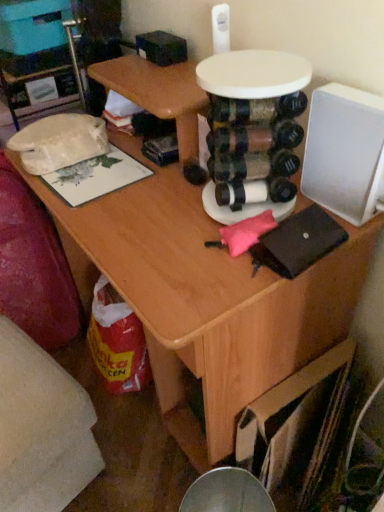
This screenshot has width=384, height=512. What do you see at coordinates (34, 267) in the screenshot?
I see `white fabric swivel chair at lower left` at bounding box center [34, 267].

Measure the distance between white fabric swivel chair at lower left and camera.

white fabric swivel chair at lower left is 1.22 meters away from camera.

At what (x,y) coordinates should I click in order to perform the action: click on white fabric swivel chair at lower left. Please return your answer as a coordinate pair (x, y). This screenshot has width=384, height=512. Looking at the image, I should click on (34, 267).

Measure the distance between point (50, 323) and camera.

Point (50, 323) is 4.84 feet away from camera.

Describe the element at coordinates (253, 131) in the screenshot. I see `white plastic round table at center` at that location.

Locate an element on the screen. This screenshot has height=512, width=384. white plastic round table at center is located at coordinates (253, 131).

This screenshot has height=512, width=384. I want to click on white fabric swivel chair at lower left, so click(x=34, y=267).

Based on the photo, in the image, is white fabric swivel chair at lower left on the left side or the right side of white plastic round table at center?

Based on their positions, white fabric swivel chair at lower left is located to the left of white plastic round table at center.

Which object is further away from the camera, white fabric swivel chair at lower left or white plastic round table at center?

white fabric swivel chair at lower left is behind.

Is point (16, 217) more distant than point (261, 109)?

Yes, it is behind point (261, 109).

Based on the photo, from the image's perspective, which is below, white fabric swivel chair at lower left or white plastic round table at center?

white fabric swivel chair at lower left appears lower in the image.

From a real-world perspective, is white fabric swivel chair at lower left physically below white plastic round table at center?

Yes, from a real-world perspective, white fabric swivel chair at lower left is beneath white plastic round table at center.

Which of these two, white fabric swivel chair at lower left or white plastic round table at center, is wider?

white fabric swivel chair at lower left is wider.

Between white fabric swivel chair at lower left and white plastic round table at center, which one has more height?

white fabric swivel chair at lower left is taller.

Considering the relative sizes of white fabric swivel chair at lower left and white plastic round table at center in the image provided, is white fabric swivel chair at lower left smaller than white plastic round table at center?

No, white fabric swivel chair at lower left is not smaller than white plastic round table at center.

Is white fabric swivel chair at lower left not inside white plastic round table at center?

Yes, white fabric swivel chair at lower left is outside of white plastic round table at center.

Is white fabric swivel chair at lower left positioned far away from white plastic round table at center?

That's not correct — white fabric swivel chair at lower left is a little close to white plastic round table at center.

Is white fabric swivel chair at lower left oriented towards white plastic round table at center?

No, white fabric swivel chair at lower left is not facing towards white plastic round table at center.

What's the angular difference between white fabric swivel chair at lower left and white plastic round table at center's facing directions?

There is a 83.6-degree angle between the facing directions of white fabric swivel chair at lower left and white plastic round table at center.

The height and width of the screenshot is (512, 384). I want to click on round table above the white fabric swivel chair at lower left (from the image's perspective), so click(x=253, y=131).

Visually, is white plastic round table at center positioned to the left or to the right of white fabric swivel chair at lower left?

Clearly, white plastic round table at center is on the right of white fabric swivel chair at lower left in the image.

Does white plastic round table at center come in front of white fabric swivel chair at lower left?

Yes, it is.

Between point (271, 113) and point (40, 328), which one is positioned behind?

Positioned behind is point (40, 328).

From the image's perspective, is white plastic round table at center positioned above or below white fabric swivel chair at lower left?

white plastic round table at center is situated higher than white fabric swivel chair at lower left in the image.

From a real-world perspective, between white plastic round table at center and white fabric swivel chair at lower left, who is vertically lower?

From a 3D spatial view, white fabric swivel chair at lower left is below.

Looking at their sizes, would you say white plastic round table at center is wider or thinner than white fabric swivel chair at lower left?

white plastic round table at center is thinner than white fabric swivel chair at lower left.

Between white plastic round table at center and white fabric swivel chair at lower left, which one has less height?

white plastic round table at center is shorter.

Looking at the image, does white plastic round table at center seem bigger or smaller compared to white fabric swivel chair at lower left?

white plastic round table at center is smaller than white fabric swivel chair at lower left.

Would you say white plastic round table at center is inside or outside white fabric swivel chair at lower left?

white plastic round table at center lies outside white fabric swivel chair at lower left.

Are white plastic round table at center and white fabric swivel chair at lower left far apart?

No, white plastic round table at center is not far from white fabric swivel chair at lower left.

Is white plastic round table at center aimed at white fabric swivel chair at lower left?

No.

Find the location of a particular element. round table that is in front of the white fabric swivel chair at lower left is located at coordinates (253, 131).

This screenshot has width=384, height=512. I want to click on round table that is above the white fabric swivel chair at lower left (from the image's perspective), so click(253, 131).

Where is `round table in front of the white fabric swivel chair at lower left`? Image resolution: width=384 pixels, height=512 pixels. round table in front of the white fabric swivel chair at lower left is located at coordinates (253, 131).